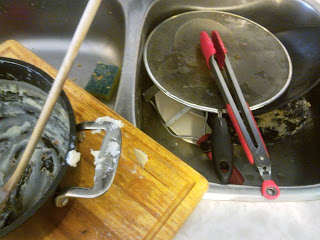
Locate an element on the screen. Image resolution: width=320 pixels, height=240 pixels. wood cutting board is located at coordinates (131, 203).